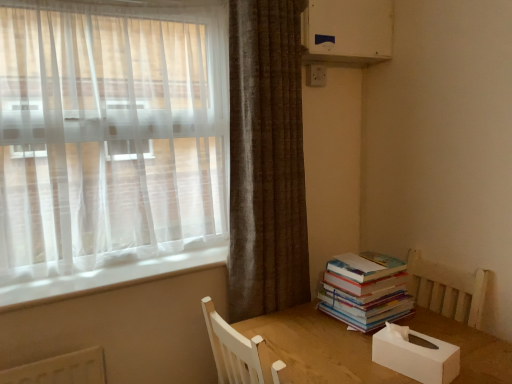
Question: Is sheer white curtain at left, the 1th curtain in the left-to-right sequence, far from white plastic electric outlet at upper center?

Choices:
 (A) no
 (B) yes

Answer: (A)

Question: Can you confirm if sheer white curtain at left, the 1th curtain in the left-to-right sequence, is thinner than white plastic electric outlet at upper center?

Choices:
 (A) yes
 (B) no

Answer: (B)

Question: Is sheer white curtain at left, marked as the second curtain in a right-to-left arrangement, facing towards white plastic electric outlet at upper center?

Choices:
 (A) no
 (B) yes

Answer: (A)

Question: Is sheer white curtain at left, the 1th curtain in the left-to-right sequence, turned away from white plastic electric outlet at upper center?

Choices:
 (A) no
 (B) yes

Answer: (A)

Question: Does sheer white curtain at left, the 1th curtain in the left-to-right sequence, appear on the right side of white plastic electric outlet at upper center?

Choices:
 (A) yes
 (B) no

Answer: (B)

Question: Choose the correct answer: Is white plastic electric outlet at upper center inside white matte tissue box at lower right or outside it?

Choices:
 (A) inside
 (B) outside

Answer: (B)

Question: Considering the positions of white plastic electric outlet at upper center and white matte tissue box at lower right in the image, is white plastic electric outlet at upper center wider or thinner than white matte tissue box at lower right?

Choices:
 (A) thin
 (B) wide

Answer: (A)

Question: Relative to white matte tissue box at lower right, is white plastic electric outlet at upper center in front or behind?

Choices:
 (A) front
 (B) behind

Answer: (B)

Question: From their relative heights in the image, would you say white plastic electric outlet at upper center is taller or shorter than white matte tissue box at lower right?

Choices:
 (A) tall
 (B) short

Answer: (B)

Question: Based on their sizes in the image, would you say white plastic electric outlet at upper center is bigger or smaller than white plastic window sill at lower left?

Choices:
 (A) small
 (B) big

Answer: (A)

Question: From a real-world perspective, is white plastic electric outlet at upper center positioned above or below white plastic window sill at lower left?

Choices:
 (A) above
 (B) below

Answer: (A)

Question: Considering their positions, is white plastic electric outlet at upper center located in front of or behind white plastic window sill at lower left?

Choices:
 (A) behind
 (B) front

Answer: (A)

Question: Is white plastic electric outlet at upper center to the left or to the right of white plastic window sill at lower left in the image?

Choices:
 (A) right
 (B) left

Answer: (A)

Question: In terms of size, does white matte tissue box at lower right appear bigger or smaller than sheer white curtain at left, the 1th curtain in the left-to-right sequence?

Choices:
 (A) big
 (B) small

Answer: (B)

Question: Considering the positions of white matte tissue box at lower right and sheer white curtain at left, the 1th curtain in the left-to-right sequence, in the image, is white matte tissue box at lower right taller or shorter than sheer white curtain at left, the 1th curtain in the left-to-right sequence,?

Choices:
 (A) short
 (B) tall

Answer: (A)